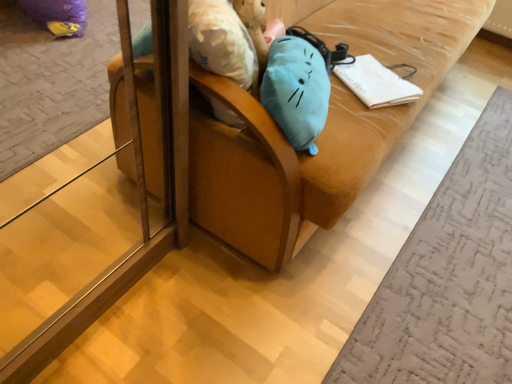
Question: Considering the positions of white paper at center and velvet brown armchair at center in the image, is white paper at center taller or shorter than velvet brown armchair at center?

Choices:
 (A) tall
 (B) short

Answer: (B)

Question: From a real-world perspective, relative to velvet brown armchair at center, is white paper at center vertically above or below?

Choices:
 (A) above
 (B) below

Answer: (B)

Question: Considering the positions of point tap(371, 66) and point tap(448, 39), is point tap(371, 66) closer or farther from the camera than point tap(448, 39)?

Choices:
 (A) closer
 (B) farther

Answer: (A)

Question: Is velvet brown armchair at center in front of or behind white paper at center in the image?

Choices:
 (A) behind
 (B) front

Answer: (B)

Question: From a real-world perspective, is velvet brown armchair at center positioned above or below white paper at center?

Choices:
 (A) below
 (B) above

Answer: (B)

Question: Considering the positions of velvet brown armchair at center and white paper at center in the image, is velvet brown armchair at center taller or shorter than white paper at center?

Choices:
 (A) tall
 (B) short

Answer: (A)

Question: Is velvet brown armchair at center spatially inside white paper at center, or outside of it?

Choices:
 (A) inside
 (B) outside

Answer: (B)